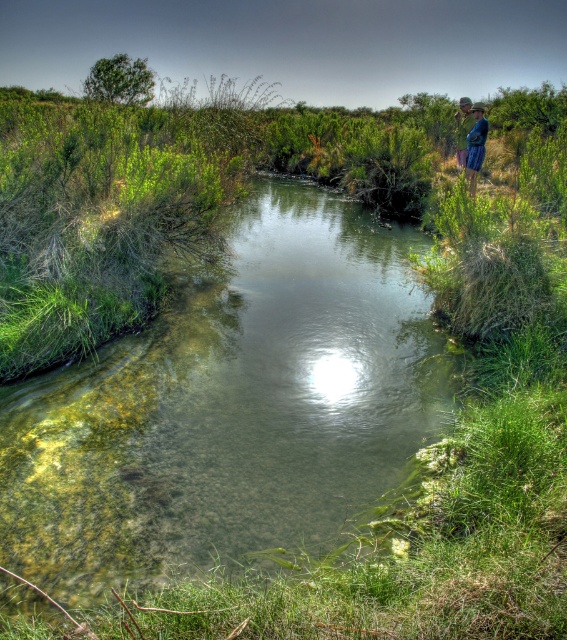
Which is in front, point (400, 268) or point (463, 148)?

Point (400, 268) is more forward.

Describe the element at coordinates (230, 406) in the screenshot. I see `clear water at upper center` at that location.

Locate an element on the screen. The width and height of the screenshot is (567, 640). clear water at upper center is located at coordinates (230, 406).

Is blue denim shorts at upper right positioned in front of blue denim jeans at upper right?

Yes, it is.

Is point (475, 172) behind point (462, 102)?

That is False.

What are the coordinates of `blue denim shorts at upper right` in the screenshot? It's located at (476, 147).

Can you confirm if clear water at upper center is positioned to the left of blue denim shorts at upper right?

Correct, you'll find clear water at upper center to the left of blue denim shorts at upper right.

Who is higher up, clear water at upper center or blue denim shorts at upper right?

blue denim shorts at upper right is higher up.

Between point (200, 461) and point (472, 150), which one is positioned behind?

The point (472, 150) is behind.

I want to click on clear water at upper center, so click(230, 406).